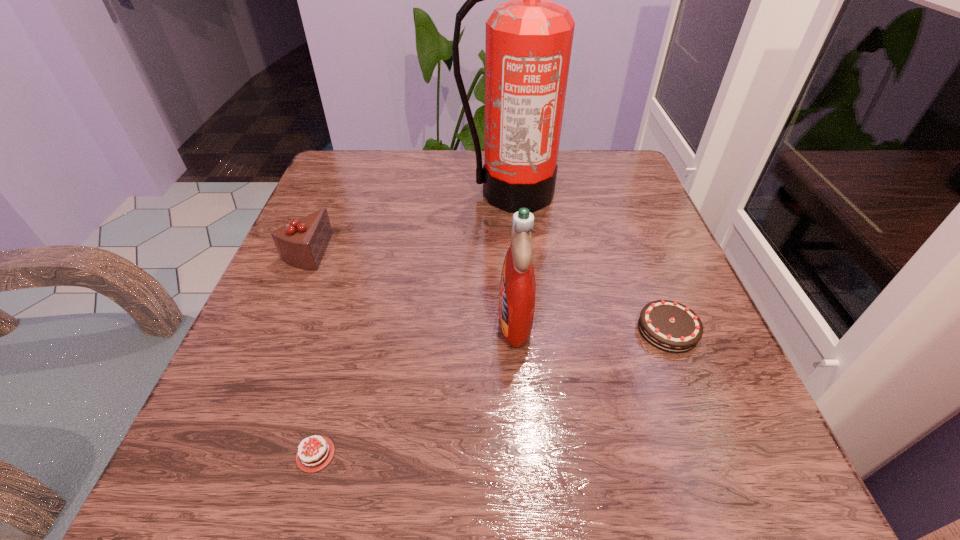
This screenshot has height=540, width=960. In order to click on vacant space at the far edge of the desktop in this screenshot , I will do `click(554, 197)`.

Where is `free space at the near edge`? Image resolution: width=960 pixels, height=540 pixels. free space at the near edge is located at coordinates (480, 446).

Locate an element on the screen. This screenshot has width=960, height=540. vacant space at the left edge of the desktop is located at coordinates (331, 215).

Locate an element on the screen. vacant region at the right edge of the desktop is located at coordinates (594, 244).

This screenshot has height=540, width=960. In the image, there is a desktop. Find the location of `free space at the far left corner`. free space at the far left corner is located at coordinates (374, 182).

In the image, there is a desktop. Where is `free region at the near left corner`? This screenshot has width=960, height=540. free region at the near left corner is located at coordinates (191, 478).

This screenshot has width=960, height=540. In order to click on free area in between the fourth nearest object and the rightmost object in this screenshot , I will do `click(487, 291)`.

Locate an element on the screen. free space that is in between the fourth tallest object and the detergent is located at coordinates (591, 325).

The width and height of the screenshot is (960, 540). Identify the location of blank region between the third tallest object and the fourth tallest object. (487, 291).

Identify the location of vacant space that is in between the rightmost object and the detergent. Image resolution: width=960 pixels, height=540 pixels. (591, 325).